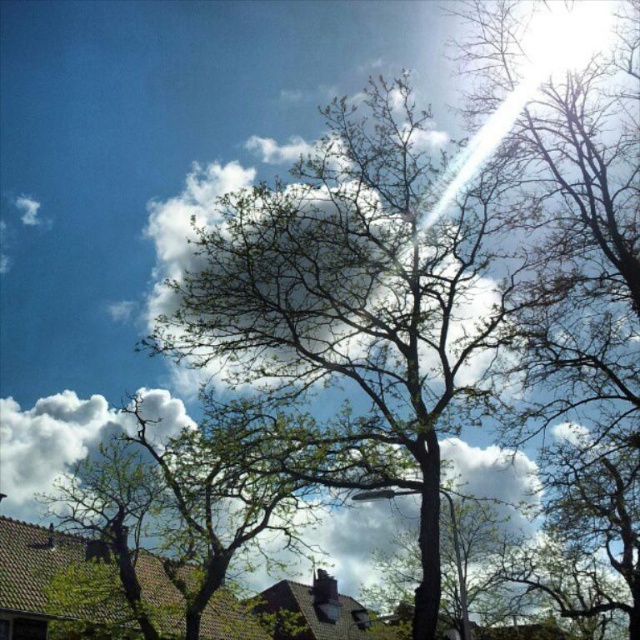
Question: Does green leafy tree at center appear under white fluffy cloud at upper left?

Choices:
 (A) yes
 (B) no

Answer: (A)

Question: Can you confirm if green leafy tree at center is smaller than white fluffy cloud at upper left?

Choices:
 (A) yes
 (B) no

Answer: (A)

Question: Is the position of green leafy tree at center less distant than that of white fluffy cloud at upper left?

Choices:
 (A) yes
 (B) no

Answer: (A)

Question: Which object appears closest to the camera in this image?

Choices:
 (A) white fluffy cloud at upper left
 (B) green leafy tree at center

Answer: (B)